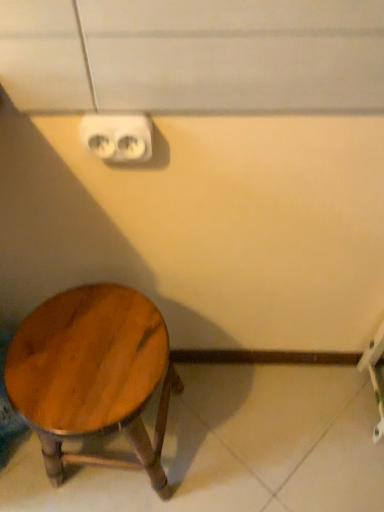
What is the approximate width of shiny brown wood stool at lower left?

shiny brown wood stool at lower left is 11.27 inches in width.

The image size is (384, 512). Describe the element at coordinates (93, 376) in the screenshot. I see `shiny brown wood stool at lower left` at that location.

Where is `shiny brown wood stool at lower left`? shiny brown wood stool at lower left is located at coordinates (93, 376).

Identify the location of white plastic outlet at upper center. The height and width of the screenshot is (512, 384). (117, 137).

Describe the element at coordinates (117, 137) in the screenshot. I see `white plastic outlet at upper center` at that location.

Image resolution: width=384 pixels, height=512 pixels. In order to click on shiny brown wood stool at lower left in this screenshot , I will do `click(93, 376)`.

Which object is positioned more to the right, shiny brown wood stool at lower left or white plastic outlet at upper center?

white plastic outlet at upper center is more to the right.

Which object is closer to the camera, shiny brown wood stool at lower left or white plastic outlet at upper center?

white plastic outlet at upper center.

Which is closer to the camera, (158, 359) or (151, 146)?

The point (151, 146) is closer to the camera.

From the image's perspective, which is below, shiny brown wood stool at lower left or white plastic outlet at upper center?

shiny brown wood stool at lower left is shown below in the image.

From a real-world perspective, who is located lower, shiny brown wood stool at lower left or white plastic outlet at upper center?

From a 3D spatial view, shiny brown wood stool at lower left is below.

Is shiny brown wood stool at lower left wider or thinner than white plastic outlet at upper center?

Considering their sizes, shiny brown wood stool at lower left looks broader than white plastic outlet at upper center.

Is shiny brown wood stool at lower left taller or shorter than white plastic outlet at upper center?

In the image, shiny brown wood stool at lower left appears to be taller than white plastic outlet at upper center.

Who is bigger, shiny brown wood stool at lower left or white plastic outlet at upper center?

shiny brown wood stool at lower left.

Is white plastic outlet at upper center a part of shiny brown wood stool at lower left?

No, white plastic outlet at upper center is located outside of shiny brown wood stool at lower left.

Is shiny brown wood stool at lower left touching white plastic outlet at upper center?

No.

Is shiny brown wood stool at lower left aimed at white plastic outlet at upper center?

No, shiny brown wood stool at lower left does not turn towards white plastic outlet at upper center.

How different are the orientations of shiny brown wood stool at lower left and white plastic outlet at upper center in degrees?

The angle between the facing direction of shiny brown wood stool at lower left and the facing direction of white plastic outlet at upper center is 0.893 degrees.

This screenshot has height=512, width=384. In order to click on stool on the left side of white plastic outlet at upper center in this screenshot , I will do `click(93, 376)`.

Which object is positioned more to the left, white plastic outlet at upper center or shiny brown wood stool at lower left?

Positioned to the left is shiny brown wood stool at lower left.

Is white plastic outlet at upper center in front of or behind shiny brown wood stool at lower left in the image?

Clearly, white plastic outlet at upper center is in front of shiny brown wood stool at lower left.

Considering the positions of point (138, 140) and point (152, 342), is point (138, 140) closer or farther from the camera than point (152, 342)?

Point (138, 140).

From the image's perspective, which is above, white plastic outlet at upper center or shiny brown wood stool at lower left?

white plastic outlet at upper center is shown above in the image.

From a real-world perspective, does white plastic outlet at upper center stand above shiny brown wood stool at lower left?

Yes.

Which of these two, white plastic outlet at upper center or shiny brown wood stool at lower left, is wider?

Wider between the two is shiny brown wood stool at lower left.

Who is taller, white plastic outlet at upper center or shiny brown wood stool at lower left?

With more height is shiny brown wood stool at lower left.

Between white plastic outlet at upper center and shiny brown wood stool at lower left, which one has smaller size?

With smaller size is white plastic outlet at upper center.

Is white plastic outlet at upper center inside or outside of shiny brown wood stool at lower left?

white plastic outlet at upper center is not enclosed by shiny brown wood stool at lower left.

Is white plastic outlet at upper center next to shiny brown wood stool at lower left?

white plastic outlet at upper center and shiny brown wood stool at lower left are not in contact.

In the scene shown: Could you tell me if white plastic outlet at upper center is turned towards shiny brown wood stool at lower left?

No, white plastic outlet at upper center is not aimed at shiny brown wood stool at lower left.

What's the angular difference between white plastic outlet at upper center and shiny brown wood stool at lower left's facing directions?

They differ by 0.893 degrees in their facing directions.

How much distance is there between white plastic outlet at upper center and shiny brown wood stool at lower left?

A distance of 45.82 centimeters exists between white plastic outlet at upper center and shiny brown wood stool at lower left.

This screenshot has height=512, width=384. In order to click on electric outlet above the shiny brown wood stool at lower left (from the image's perspective) in this screenshot , I will do `click(117, 137)`.

You are a GUI agent. You are given a task and a screenshot of the screen. Output one action in this format:
    pyautogui.click(x=<x>, y=<y>)
    Task: Click on the electric outlet above the shiny brown wood stool at lower left (from a real-world perspective)
    This screenshot has height=512, width=384.
    Given the screenshot: What is the action you would take?
    pyautogui.click(x=117, y=137)

The height and width of the screenshot is (512, 384). Identify the location of stool below the white plastic outlet at upper center (from the image's perspective). (93, 376).